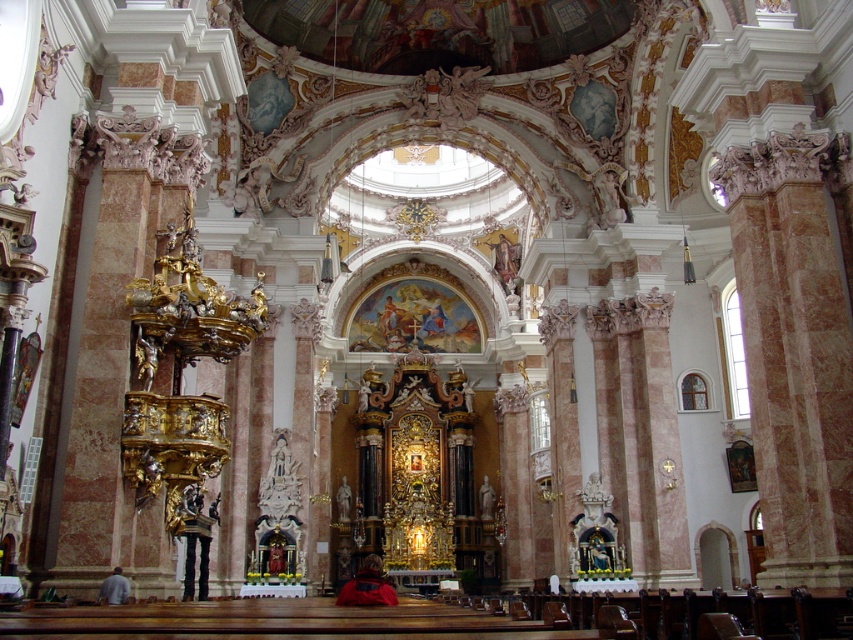
You are an interior designer assessing the placement of jackets in the church. The red jacket at center and gray fabric jacket at lower left are both hanging on the same rack. Which jacket is closer to the floor?

The red jacket at center is closer to the floor because it is positioned under the gray fabric jacket at lower left.

You are standing in the church and see two jackets. The red jacket at center and the gray fabric jacket at lower left. Which jacket is positioned to the right of the other?

The red jacket at center is to the right of the gray fabric jacket at lower left.